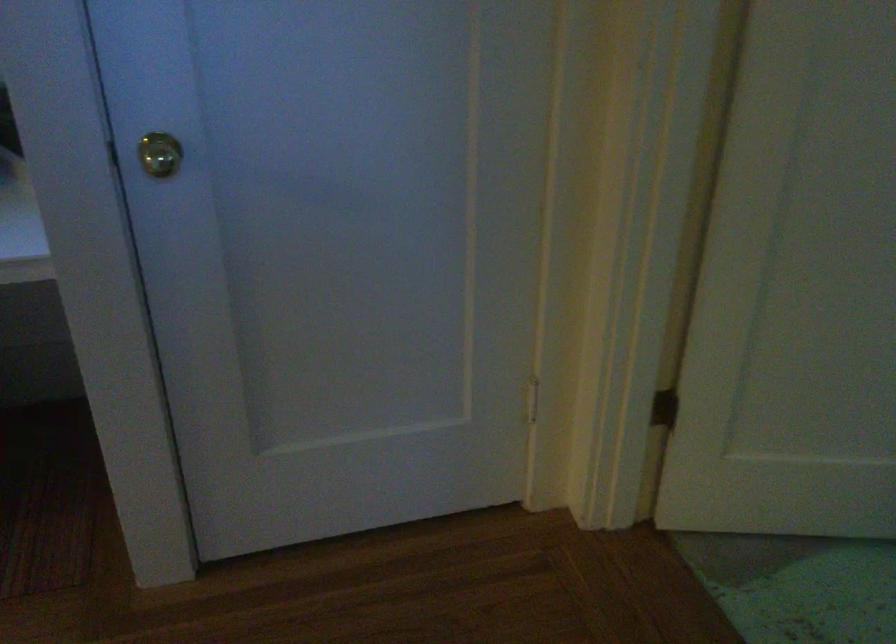
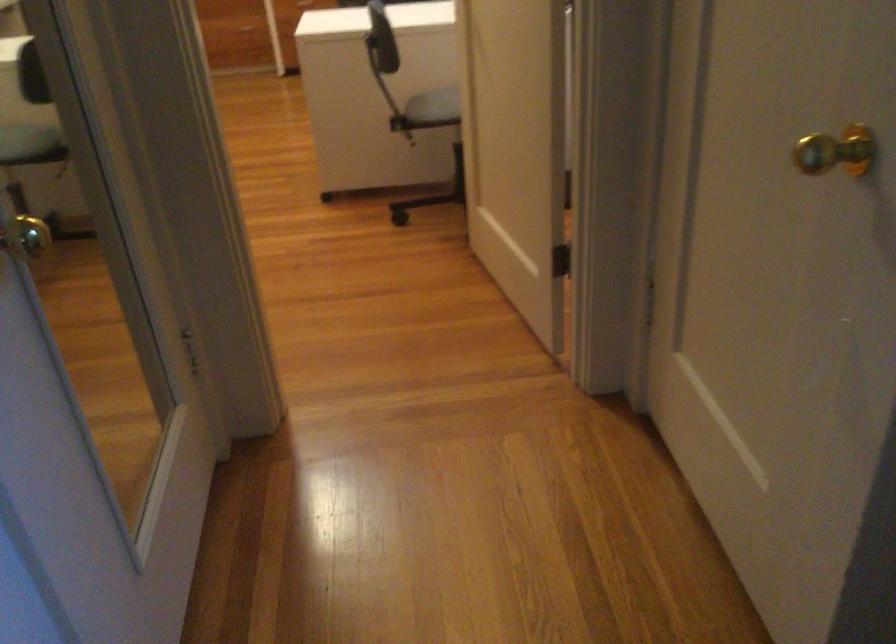
The images are taken continuously from a first-person perspective. In which direction is your viewpoint rotating?

The camera's rotation is toward left-down.